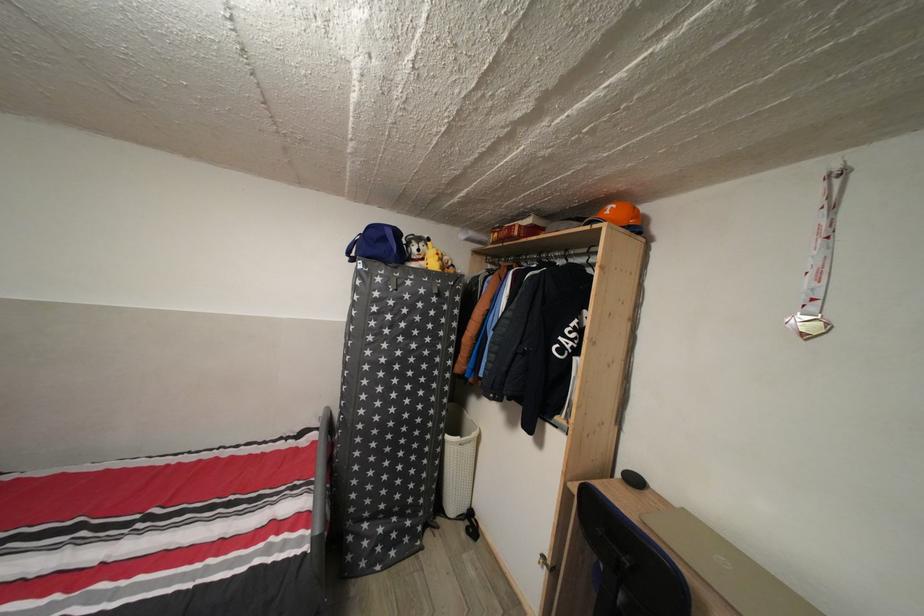
You are a GUI agent. You are given a task and a screenshot of the screen. Output one action in this format:
    pyautogui.click(x=<x>, y=<y>)
    Task: Click on the hanging medal
    The image size is (924, 616).
    Given the screenshot: What is the action you would take?
    pyautogui.click(x=820, y=259)